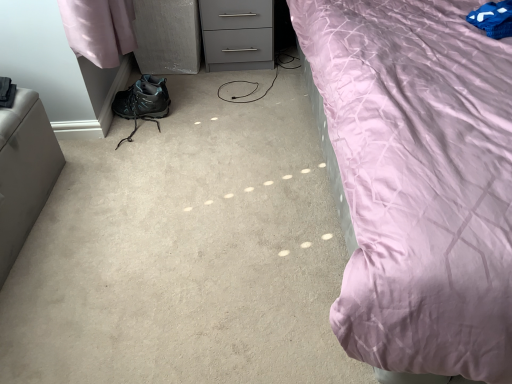
The height and width of the screenshot is (384, 512). Find the location of `free space in front of matte black boot at lower left`. free space in front of matte black boot at lower left is located at coordinates pyautogui.click(x=123, y=165).